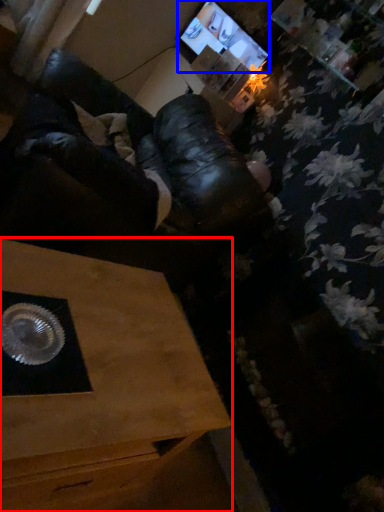
Question: Which object appears closest to the camera in this image, table (highlighted by a red box) or computer monitor (highlighted by a blue box)?

Choices:
 (A) table
 (B) computer monitor

Answer: (A)